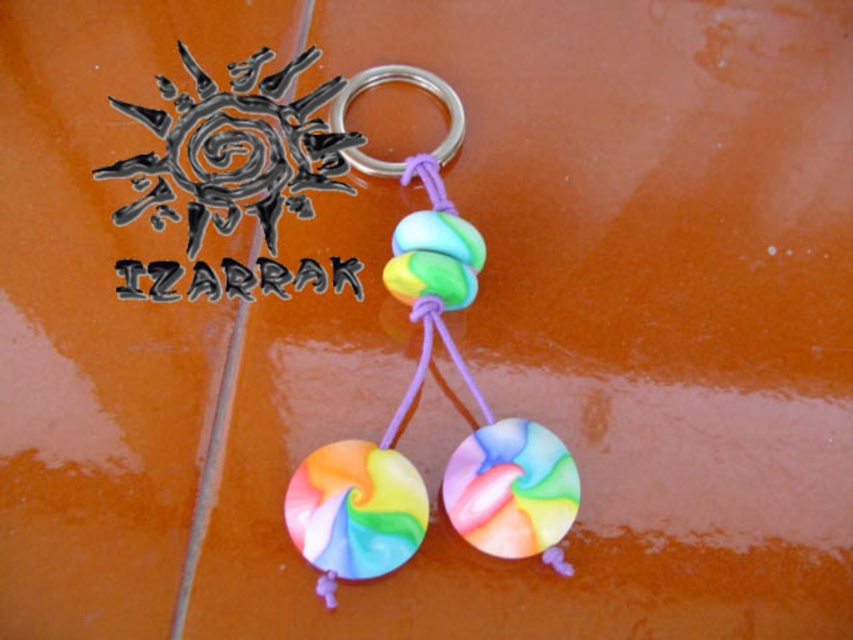
You are holding a small magnifying glass to examine the keychain and beads. Which object is closer to the surface you are observing, the swirled polymer clay keychain at center or the rainbow marbled bead at center?

The swirled polymer clay keychain at center is positioned under the rainbow marbled bead at center, so the rainbow marbled bead at center is closer to the surface you are observing.

You are looking at the keychain on the orange brown tiles. Where is the rainbow marbled bead at center located in terms of coordinates?

The rainbow marbled bead at center is located at coordinates point (511, 488).

You are holding a camera and want to take a photo of the swirled polymer clay keychain at center and the rainbow marbled bead at center. Which object should you focus on first to ensure both are in sharp focus?

You should focus on the swirled polymer clay keychain at center first because it is closer to the viewer than the rainbow marbled bead at center, so focusing on the closer object will help both be in focus.